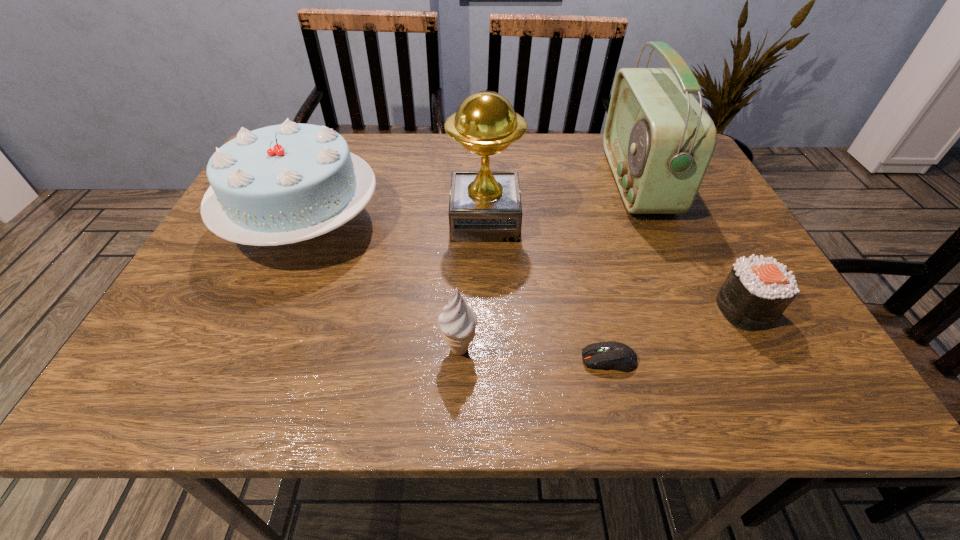
Find the location of a particular element. This screenshot has height=540, width=960. free location located 0.220m on the front panel of the radio receiver is located at coordinates (525, 181).

Find the location of a particular element. The image size is (960, 540). vacant region located on the front panel of the radio receiver is located at coordinates (514, 181).

Find the location of a particular element. vacant space situated on the front-facing side of the award is located at coordinates (389, 220).

I want to click on vacant space located on the front-facing side of the award, so click(380, 220).

Where is `vacant space located on the front-facing side of the award`? vacant space located on the front-facing side of the award is located at coordinates (276, 220).

Locate an element on the screen. This screenshot has width=960, height=540. vacant point located 0.330m on the right of the third tallest object is located at coordinates (525, 223).

Identify the location of vacant space located 0.350m on the front-facing side of the icecream. (678, 349).

Where is `vacant space located 0.130m on the back of the fourth farthest object`? vacant space located 0.130m on the back of the fourth farthest object is located at coordinates (710, 245).

You are a GUI agent. You are given a task and a screenshot of the screen. Output one action in this format:
    pyautogui.click(x=<x>, y=<y>)
    Task: Click on the vacant space located 0.260m on the button of the shortest object
    This screenshot has width=960, height=540.
    Given the screenshot: What is the action you would take?
    pyautogui.click(x=430, y=360)

Identify the location of vacant position located 0.390m on the button of the shortest object. coord(354,360).